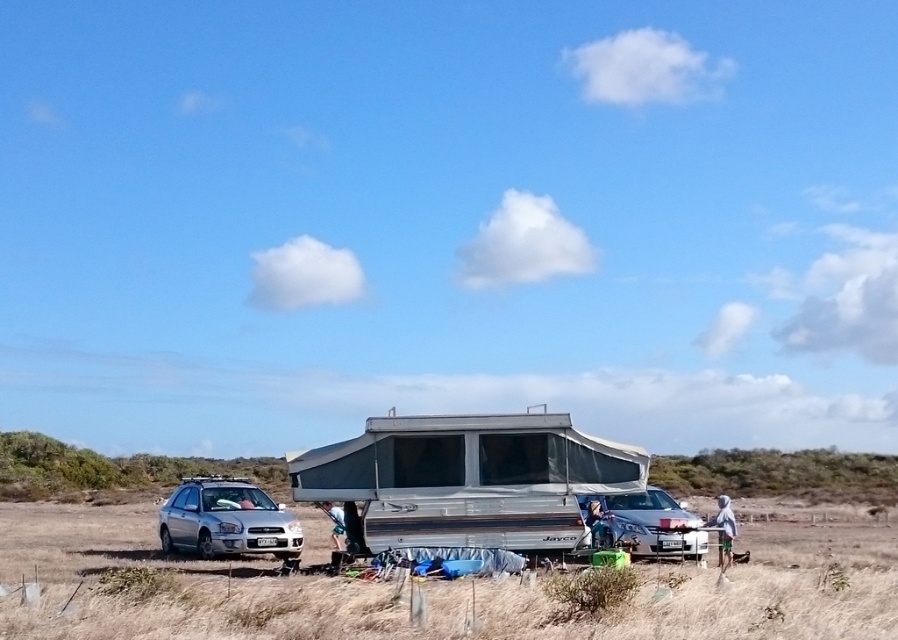
You are a photographer planning to take a photo of the satin silver car at left and the satin silver car at center in the camping scene. Since both cars are silver, you want to highlight their height difference. Which car should you position closer to the camera to emphasize their height difference?

The satin silver car at left is taller than the satin silver car at center. To emphasize their height difference, position the shorter satin silver car at center closer to the camera so its apparent size matches the taller car, making the height difference more noticeable.

You are a photographer wanting to capture both the satin silver car at left and the satin silver car at center in a single shot. Given their positions, which car should you position closer to the camera to ensure both are fully visible in the frame?

The satin silver car at left is below the satin silver car at center. To ensure both are fully visible, position the satin silver car at left closer to the camera since it is lower and might be obscured by the other car otherwise.